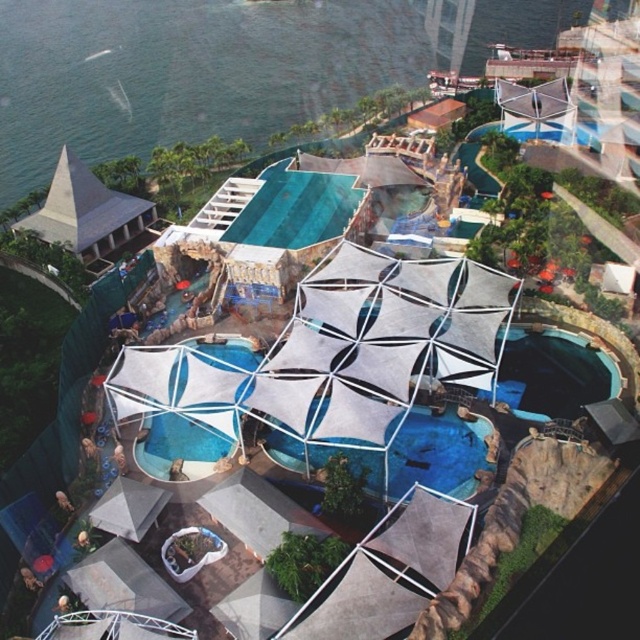
You are a guest staying at the resort and want to take a photo of the white fabric pool at center and the matte gray pyramid at upper left together in the same frame. From which side of the resort should you position yourself to ensure both objects are visible?

To capture both the white fabric pool at center and the matte gray pyramid at upper left in the same frame, position yourself behind the matte gray pyramid at upper left. Since the white fabric pool at center is in front of the matte gray pyramid at upper left, positioning yourself behind the pyramid will allow you to see both objects with the pool in the foreground and the pyramid in the background.

You are a drone operator tasked with capturing aerial footage of the resort. Your drone has a maximum flight range of 150 feet from its starting point. If you begin your flight from the transparent plastic pool at center, will you be able to fly directly to the matte gray pyramid at upper left without exceeding the drone range limit?

The transparent plastic pool at center and matte gray pyramid at upper left are 173.27 feet apart from each other. Since the drone has a maximum range of 150 feet, flying directly to the matte gray pyramid at upper left from the transparent plastic pool at center would exceed the drone range limit.